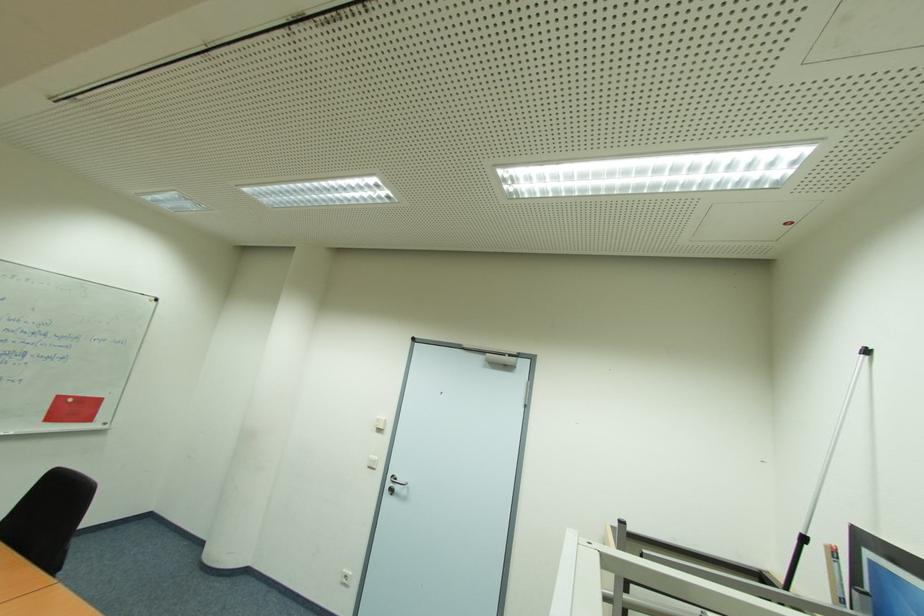
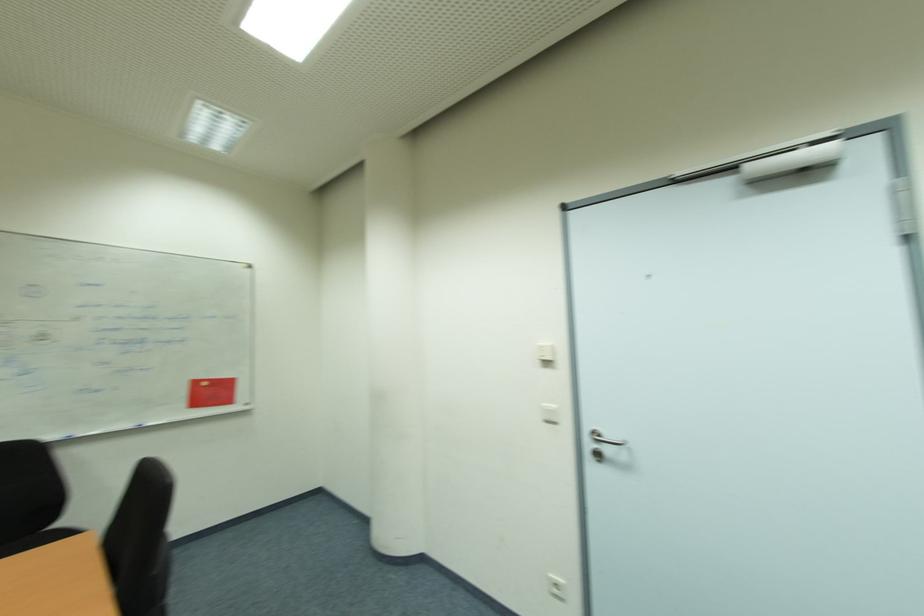
The point at [380,459] is marked in the first image. Where is the corresponding point in the second image?

(556, 407)